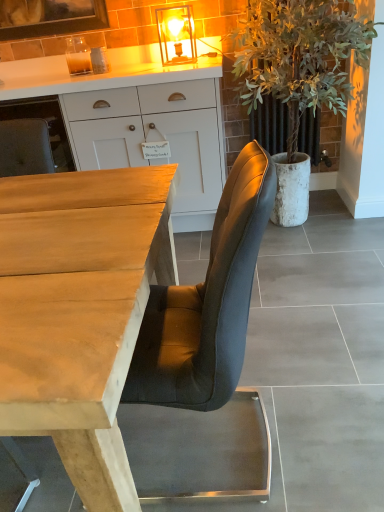
Where is `wooden desk at center`? wooden desk at center is located at coordinates (79, 311).

Locate an element on the screen. The height and width of the screenshot is (512, 384). white matte cabinet at upper center is located at coordinates (140, 117).

This screenshot has height=512, width=384. What do you see at coordinates (140, 117) in the screenshot? I see `white matte cabinet at upper center` at bounding box center [140, 117].

In order to face smooth gray concrete at center, should I rotate leftwards or rightwards?

You should rotate left by 3.539 degrees.

I want to click on wooden desk at center, so click(79, 311).

From a real-world perspective, between smooth gray concrete at center and green leafy plant at right, who is vertically lower?

From a 3D spatial view, smooth gray concrete at center is below.

Is smooth gray concrete at center oriented towards green leafy plant at right?

No, smooth gray concrete at center is not aimed at green leafy plant at right.

Is smooth gray concrete at center outside of green leafy plant at right?

Yes, smooth gray concrete at center is not within green leafy plant at right.

Considering the relative positions of smooth gray concrete at center and green leafy plant at right in the image provided, is smooth gray concrete at center to the right of green leafy plant at right from the viewer's perspective?

No, smooth gray concrete at center is not to the right of green leafy plant at right.

Which object is positioned more to the right, white matte cabinet at upper center or smooth gray concrete at center?

From the viewer's perspective, smooth gray concrete at center appears more on the right side.

Considering the relative sizes of white matte cabinet at upper center and smooth gray concrete at center in the image provided, is white matte cabinet at upper center thinner than smooth gray concrete at center?

In fact, white matte cabinet at upper center might be wider than smooth gray concrete at center.

Considering the sizes of white matte cabinet at upper center and smooth gray concrete at center in the image, is white matte cabinet at upper center taller or shorter than smooth gray concrete at center?

white matte cabinet at upper center is taller than smooth gray concrete at center.

Is white matte cabinet at upper center positioned with its back to smooth gray concrete at center?

white matte cabinet at upper center is not turned away from smooth gray concrete at center.

Considering the relative sizes of white matte cabinet at upper center and green leafy plant at right in the image provided, is white matte cabinet at upper center thinner than green leafy plant at right?

Incorrect, the width of white matte cabinet at upper center is not less than that of green leafy plant at right.

Consider the image. Measure the distance from white matte cabinet at upper center to green leafy plant at right.

white matte cabinet at upper center is 23.16 inches from green leafy plant at right.

In the scene shown: Does white matte cabinet at upper center appear on the left side of green leafy plant at right?

Yes.

From a real-world perspective, between white matte cabinet at upper center and green leafy plant at right, who is vertically higher?

In real-world perspective, green leafy plant at right is above.

Based on the photo, from a real-world perspective, which is physically above, wooden desk at center or green leafy plant at right?

green leafy plant at right, from a real-world perspective.

From the image's perspective, does wooden desk at center appear lower than green leafy plant at right?

Yes, from the image's perspective, wooden desk at center is beneath green leafy plant at right.

Would you say wooden desk at center is a long distance from green leafy plant at right?

Yes, wooden desk at center and green leafy plant at right are quite far apart.

How distant is wooden desk at center from green leafy plant at right?

A distance of 4.69 feet exists between wooden desk at center and green leafy plant at right.

Is wooden desk at center next to white matte cabinet at upper center?

No, wooden desk at center is not touching white matte cabinet at upper center.

Which object is more forward, wooden desk at center or white matte cabinet at upper center?

wooden desk at center is in front.

Is wooden desk at center bigger than white matte cabinet at upper center?

Yes.

From a real-world perspective, which is physically above, wooden desk at center or white matte cabinet at upper center?

white matte cabinet at upper center, from a real-world perspective.

How different are the orientations of green leafy plant at right and smooth gray concrete at center in degrees?

There is a 92.7-degree angle between the facing directions of green leafy plant at right and smooth gray concrete at center.

From a real-world perspective, is green leafy plant at right physically located above or below smooth gray concrete at center?

From a real-world perspective, green leafy plant at right is physically above smooth gray concrete at center.

Between green leafy plant at right and smooth gray concrete at center, which one has larger size?

green leafy plant at right.

Would you say smooth gray concrete at center is part of wooden desk at center's contents?

Absolutely, smooth gray concrete at center is inside wooden desk at center.

Between point (126, 324) and point (354, 307), which one is positioned behind?

The point (354, 307) is farther.

From a real-world perspective, is wooden desk at center physically below smooth gray concrete at center?

Yes, from a real-world perspective, wooden desk at center is below smooth gray concrete at center.

In the image, there is a green leafy plant at right. Where is `concrete below it (from the image's perspective)`? This screenshot has height=512, width=384. concrete below it (from the image's perspective) is located at coordinates (318, 361).

This screenshot has height=512, width=384. What are the coordinates of `concrete on the right of white matte cabinet at upper center` in the screenshot? It's located at (318, 361).

From the image, which object appears to be farther from wooden desk at center, green leafy plant at right or white matte cabinet at upper center?

green leafy plant at right is positioned further to the anchor wooden desk at center.

Considering their positions, is green leafy plant at right positioned further to white matte cabinet at upper center than smooth gray concrete at center?

smooth gray concrete at center.

When comparing their distances from green leafy plant at right, does white matte cabinet at upper center or wooden desk at center seem closer?

white matte cabinet at upper center is closer to green leafy plant at right.

From the picture: When comparing their distances from smooth gray concrete at center, does wooden desk at center or white matte cabinet at upper center seem closer?

Based on the image, wooden desk at center appears to be nearer to smooth gray concrete at center.

Consider the image. Which object lies nearer to the anchor point wooden desk at center, white matte cabinet at upper center or green leafy plant at right?

Based on the image, white matte cabinet at upper center appears to be nearer to wooden desk at center.

Looking at the image, which one is located closer to green leafy plant at right, white matte cabinet at upper center or smooth gray concrete at center?

white matte cabinet at upper center.

Looking at the image, which one is located further to green leafy plant at right, wooden desk at center or white matte cabinet at upper center?

The object further to green leafy plant at right is wooden desk at center.

Looking at the image, which one is located closer to smooth gray concrete at center, wooden desk at center or green leafy plant at right?

green leafy plant at right.

Where is `concrete between wooden desk at center and green leafy plant at right from front to back`? The image size is (384, 512). concrete between wooden desk at center and green leafy plant at right from front to back is located at coordinates (318, 361).

Where is `concrete between wooden desk at center and white matte cabinet at upper center along the z-axis`? The height and width of the screenshot is (512, 384). concrete between wooden desk at center and white matte cabinet at upper center along the z-axis is located at coordinates (318, 361).

Locate an element on the screen. houseplant located between smooth gray concrete at center and white matte cabinet at upper center in the depth direction is located at coordinates (363, 132).

At what (x,y) coordinates should I click in order to perform the action: click on houseplant between wooden desk at center and white matte cabinet at upper center from front to back. Please return your answer as a coordinate pair (x, y). This screenshot has width=384, height=512. Looking at the image, I should click on (363, 132).